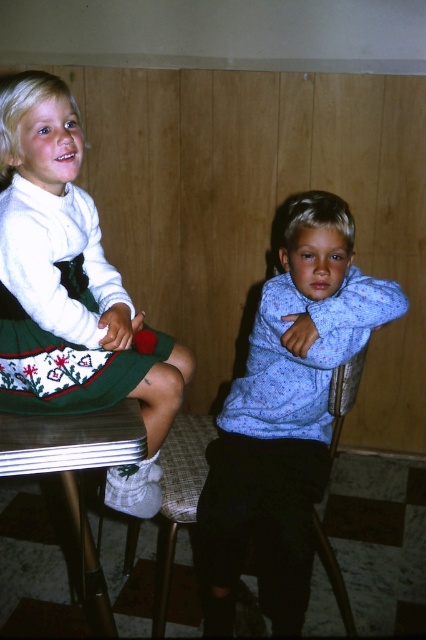
Question: Considering the relative positions of blue speckled sweater at center and green knitted dress at upper left in the image provided, where is blue speckled sweater at center located with respect to green knitted dress at upper left?

Choices:
 (A) above
 (B) below

Answer: (B)

Question: Among these objects, which one is farthest from the camera?

Choices:
 (A) green knitted dress at upper left
 (B) blue speckled sweater at center
 (C) metallic silver chair at lower center

Answer: (C)

Question: Considering the relative positions of matte green skirt at left and metallic silver table at lower left in the image provided, where is matte green skirt at left located with respect to metallic silver table at lower left?

Choices:
 (A) left
 (B) right

Answer: (A)

Question: Considering the real-world distances, which object is closest to the matte green skirt at left?

Choices:
 (A) metallic silver chair at lower center
 (B) blue speckled sweater at center
 (C) green knitted dress at upper left

Answer: (C)

Question: Where is matte green skirt at left located in relation to metallic silver table at lower left in the image?

Choices:
 (A) below
 (B) above

Answer: (B)

Question: Which point is farther to the camera?

Choices:
 (A) metallic silver table at lower left
 (B) blue speckled sweater at center

Answer: (B)